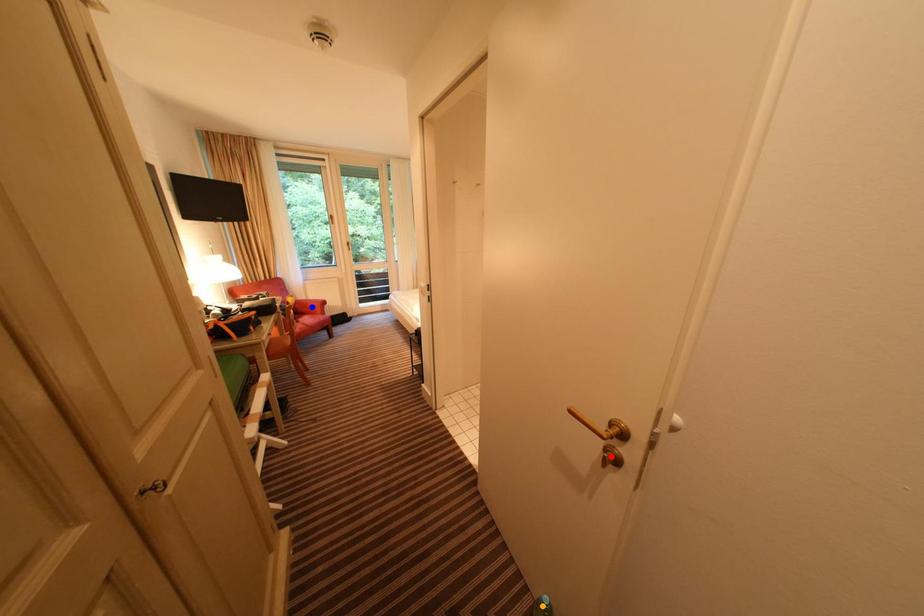
Order these from farthest to nearest:
red point
orange point
blue point

blue point
orange point
red point